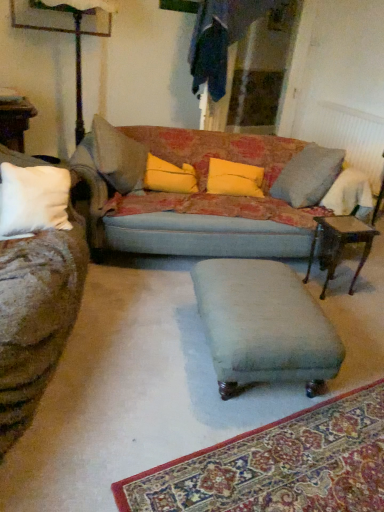
What do you see at coordinates (191, 196) in the screenshot? I see `textured fabric couch at center` at bounding box center [191, 196].

Describe the element at coordinates (234, 178) in the screenshot. This screenshot has height=512, width=384. I see `yellow fabric pillow at center, placed as the 1th pillow when sorted from right to left` at that location.

What do you see at coordinates (169, 176) in the screenshot? The image size is (384, 512). I see `yellow fabric pillow at center, which appears as the 1th pillow when viewed from the left` at bounding box center [169, 176].

What do you see at coordinates (263, 325) in the screenshot? I see `velvet teal footrest at center` at bounding box center [263, 325].

Find the location of a particular element. The image size is (384, 512). white textured radiator at upper right is located at coordinates (346, 135).

Find the location of a particular element. The width and height of the screenshot is (384, 512). textured fabric couch at center is located at coordinates (191, 196).

Considering the sizes of objects velvet teal footrest at center and textured fabric couch at center in the image provided, who is wider, velvet teal footrest at center or textured fabric couch at center?

Wider between the two is textured fabric couch at center.

From a real-world perspective, between velvet teal footrest at center and textured fabric couch at center, who is vertically higher?

textured fabric couch at center is physically above.

Is velvet teal footrest at center in contact with textured fabric couch at center?

No, velvet teal footrest at center is not with textured fabric couch at center.

Where is `footrest lying on the right of textured fabric couch at center`? The height and width of the screenshot is (512, 384). footrest lying on the right of textured fabric couch at center is located at coordinates (263, 325).

Is point (120, 180) more distant than point (333, 358)?

Yes, point (120, 180) is behind point (333, 358).

Which of these two, textured fabric couch at center or velvet teal footrest at center, is smaller?

With smaller size is velvet teal footrest at center.

Is textured fabric couch at center at the right side of velvet teal footrest at center?

In fact, textured fabric couch at center is to the left of velvet teal footrest at center.

Is the surface of textured fabric couch at center in direct contact with velvet teal footrest at center?

textured fabric couch at center is not next to velvet teal footrest at center, and they're not touching.

Locate an element on the screen. Image resolution: width=384 pixels, height=512 pixels. the 1st pillow above the velvet teal footrest at center (from the image's perspective) is located at coordinates (234, 178).

Does point (275, 282) come farther from viewer compared to point (239, 187)?

No, it is not.

From the image's perspective, is velvet teal footrest at center above yellow fabric pillow at center, placed as the 1th pillow when sorted from right to left?

No, from the image's perspective, velvet teal footrest at center is not on top of yellow fabric pillow at center, placed as the 1th pillow when sorted from right to left.

In the scene shown: Can you tell me how much velvet teal footrest at center and yellow fabric pillow at center, which ranks as the second pillow in left-to-right order, differ in facing direction?

The angle between the facing direction of velvet teal footrest at center and the facing direction of yellow fabric pillow at center, which ranks as the second pillow in left-to-right order, is 1.76 degrees.

In the scene shown: Does textured fabric couch at center turn towards yellow fabric pillow at center, which appears as the 1th pillow when viewed from the left?

Yes, textured fabric couch at center is turned towards yellow fabric pillow at center, which appears as the 1th pillow when viewed from the left.

Is yellow fabric pillow at center, placed as the 2th pillow when sorted from right to left, surrounded by textured fabric couch at center?

Yes, textured fabric couch at center is surrounding yellow fabric pillow at center, placed as the 2th pillow when sorted from right to left.

Between textured fabric couch at center and yellow fabric pillow at center, which appears as the 1th pillow when viewed from the left, which one has less height?

yellow fabric pillow at center, which appears as the 1th pillow when viewed from the left.

From a real-world perspective, between white textured radiator at upper right and yellow fabric pillow at center, placed as the 2th pillow when sorted from right to left, who is vertically higher?

From a 3D spatial view, yellow fabric pillow at center, placed as the 2th pillow when sorted from right to left, is above.

From the image's perspective, is white textured radiator at upper right below yellow fabric pillow at center, placed as the 2th pillow when sorted from right to left?

Actually, white textured radiator at upper right appears above yellow fabric pillow at center, placed as the 2th pillow when sorted from right to left, in the image.

Which of these two, white textured radiator at upper right or yellow fabric pillow at center, which appears as the 1th pillow when viewed from the left, stands shorter?

yellow fabric pillow at center, which appears as the 1th pillow when viewed from the left.

From a real-world perspective, between wooden side table at right and textured fabric couch at center, who is vertically higher?

textured fabric couch at center, from a real-world perspective.

Is point (360, 233) closer to camera compared to point (139, 218)?

That is True.

Is wooden side table at right oriented towards textured fabric couch at center?

No, wooden side table at right is not turned towards textured fabric couch at center.

Consider the image. From a real-world perspective, is yellow fabric pillow at center, placed as the 2th pillow when sorted from right to left, below white textured radiator at upper right?

Actually, yellow fabric pillow at center, placed as the 2th pillow when sorted from right to left, is physically above white textured radiator at upper right in the real world.

Based on their sizes in the image, would you say yellow fabric pillow at center, placed as the 2th pillow when sorted from right to left, is bigger or smaller than white textured radiator at upper right?

Clearly, yellow fabric pillow at center, placed as the 2th pillow when sorted from right to left, is smaller in size than white textured radiator at upper right.

Which is closer to the camera, (x=159, y=180) or (x=316, y=116)?

Clearly, point (x=159, y=180) is closer to the camera than point (x=316, y=116).

Consider the image. How different are the orientations of yellow fabric pillow at center, placed as the 2th pillow when sorted from right to left, and white textured radiator at upper right in degrees?

The facing directions of yellow fabric pillow at center, placed as the 2th pillow when sorted from right to left, and white textured radiator at upper right are 60.7 degrees apart.

Where is `studio couch behind the velvet teal footrest at center`? studio couch behind the velvet teal footrest at center is located at coordinates (191, 196).

This screenshot has width=384, height=512. Identify the location of footrest below the textured fabric couch at center (from the image's perspective). (263, 325).

Considering their positions, is yellow fabric pillow at center, which ranks as the second pillow in left-to-right order, positioned closer to wooden side table at right than white textured radiator at upper right?

The object closer to wooden side table at right is yellow fabric pillow at center, which ranks as the second pillow in left-to-right order.

From the image, which object appears to be nearer to textured fabric couch at center, wooden side table at right or velvet teal footrest at center?

Based on the image, wooden side table at right appears to be nearer to textured fabric couch at center.

Considering their positions, is white textured radiator at upper right positioned further to velvet teal footrest at center than wooden side table at right?

The object further to velvet teal footrest at center is white textured radiator at upper right.

Based on their spatial positions, is white textured radiator at upper right or yellow fabric pillow at center, placed as the 2th pillow when sorted from right to left, further from textured fabric couch at center?

white textured radiator at upper right is further to textured fabric couch at center.

When comparing their distances from yellow fabric pillow at center, placed as the 2th pillow when sorted from right to left, does wooden side table at right or textured fabric couch at center seem closer?

The object closer to yellow fabric pillow at center, placed as the 2th pillow when sorted from right to left, is textured fabric couch at center.

Considering their positions, is velvet teal footrest at center positioned closer to wooden side table at right than white textured radiator at upper right?

velvet teal footrest at center is closer to wooden side table at right.

When comparing their distances from textured fabric couch at center, does velvet teal footrest at center or yellow fabric pillow at center, which appears as the 1th pillow when viewed from the left, seem further?

velvet teal footrest at center lies further to textured fabric couch at center than the other object.

Considering their positions, is velvet teal footrest at center positioned further to wooden side table at right than textured fabric couch at center?

The object further to wooden side table at right is velvet teal footrest at center.

You are a GUI agent. You are given a task and a screenshot of the screen. Output one action in this format:
    pyautogui.click(x=<x>, y=<y>)
    Task: Click on the studio couch positioned between velvet teal footrest at center and wooden side table at right from near to far
    The width and height of the screenshot is (384, 512).
    Given the screenshot: What is the action you would take?
    pyautogui.click(x=191, y=196)

Locate an element on the screen. The height and width of the screenshot is (512, 384). pillow situated between yellow fabric pillow at center, which appears as the 1th pillow when viewed from the left, and white textured radiator at upper right from left to right is located at coordinates (234, 178).

Identify the location of studio couch between velvet teal footrest at center and white textured radiator at upper right from front to back. (191, 196).

The height and width of the screenshot is (512, 384). I want to click on table positioned between textured fabric couch at center and white textured radiator at upper right from near to far, so click(339, 244).